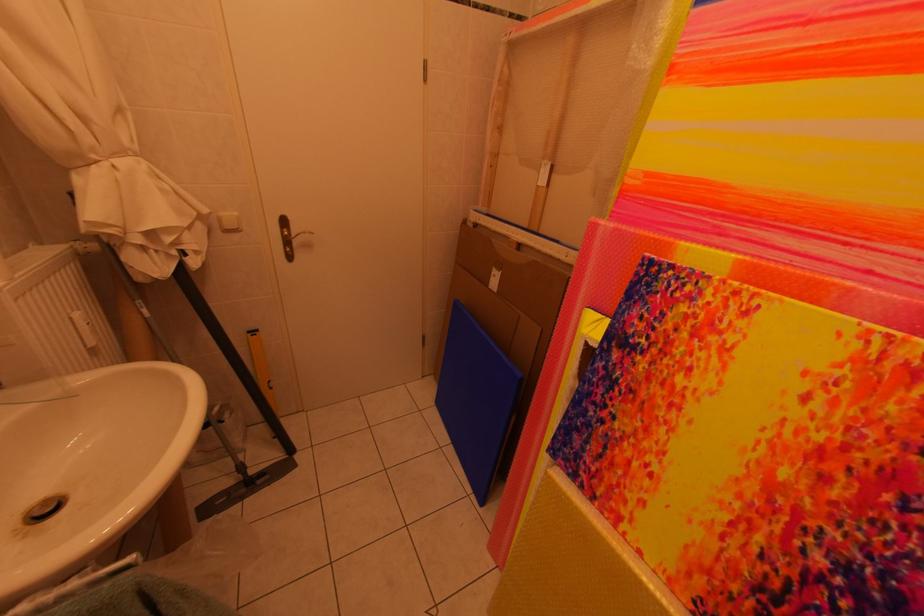
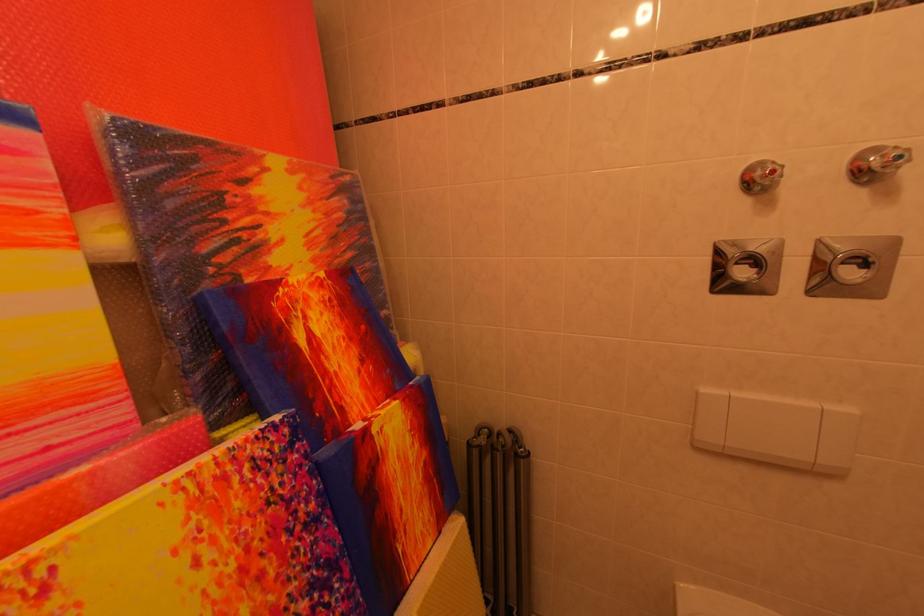
Find the pixel in the second image that matches the point at 847,496 in the first image.

(281, 575)